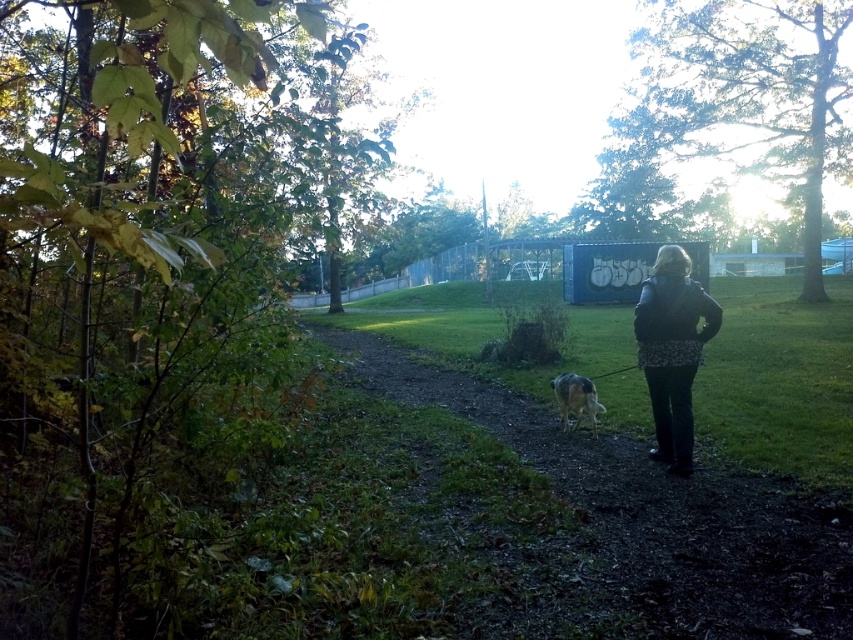
Does dirt path at center have a lesser width compared to dark blue leather jacket at right?

Incorrect, dirt path at center's width is not less than dark blue leather jacket at right's.

Can you confirm if dirt path at center is smaller than dark blue leather jacket at right?

Incorrect, dirt path at center is not smaller in size than dark blue leather jacket at right.

Measure the distance between point [637,499] and camera.

They are 4.12 meters apart.

At what (x,y) coordinates should I click in order to perform the action: click on dirt path at center. Please return your answer as a coordinate pair (x, y). This screenshot has width=853, height=640. Looking at the image, I should click on (654, 513).

Who is more distant from viewer, (680, 490) or (575, 426)?

Positioned behind is point (575, 426).

Between dirt path at center and fuzzy brown dog at center, which one has less height?

dirt path at center

Is point (544, 458) closer to viewer compared to point (575, 392)?

Yes.

Where is `dirt path at center`? This screenshot has width=853, height=640. dirt path at center is located at coordinates (654, 513).

Which is more to the left, dark blue leather jacket at right or fuzzy brown dog at center?

fuzzy brown dog at center

Between dark blue leather jacket at right and fuzzy brown dog at center, which one is positioned lower?

fuzzy brown dog at center is below.

Does point (651, 289) come in front of point (578, 390)?

Yes, it is.

Where is `dark blue leather jacket at right`? The height and width of the screenshot is (640, 853). dark blue leather jacket at right is located at coordinates (672, 349).